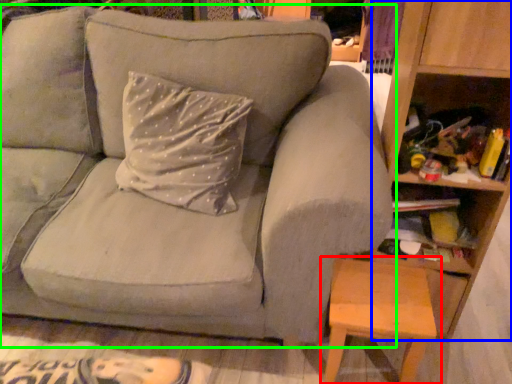
Question: Which object is positioned farthest from table (highlighted by a red box)? Select from bookshelf (highlighted by a blue box) and studio couch (highlighted by a green box).

Choices:
 (A) bookshelf
 (B) studio couch

Answer: (B)